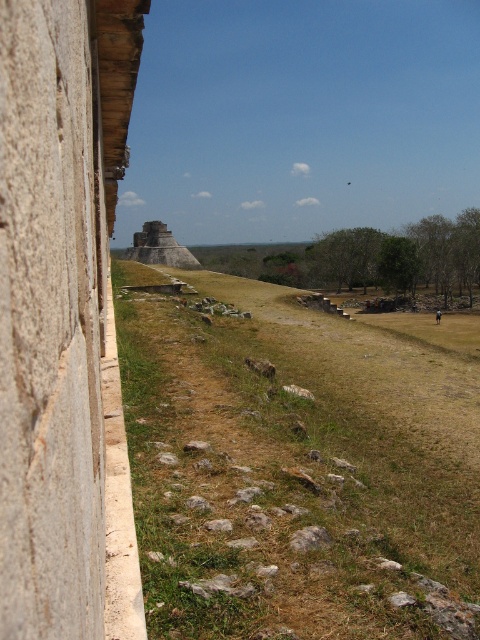
You are standing at the archaeological site and want to reach the point marked at coordinates (140, 497). If you walk straight ahead, how far will you have to go to reach that point?

The point at coordinates (140, 497) is 6.08 meters away from the viewer, so you will have to walk 6.08 meters straight ahead to reach it.

You are an archaeologist exploring the site and need to locate the smooth stone hut at left. From your current position at the green grassy at center, which direction should you move to reach it?

The smooth stone hut at left is to the left of the green grassy at center, so you should move to your left to reach it.